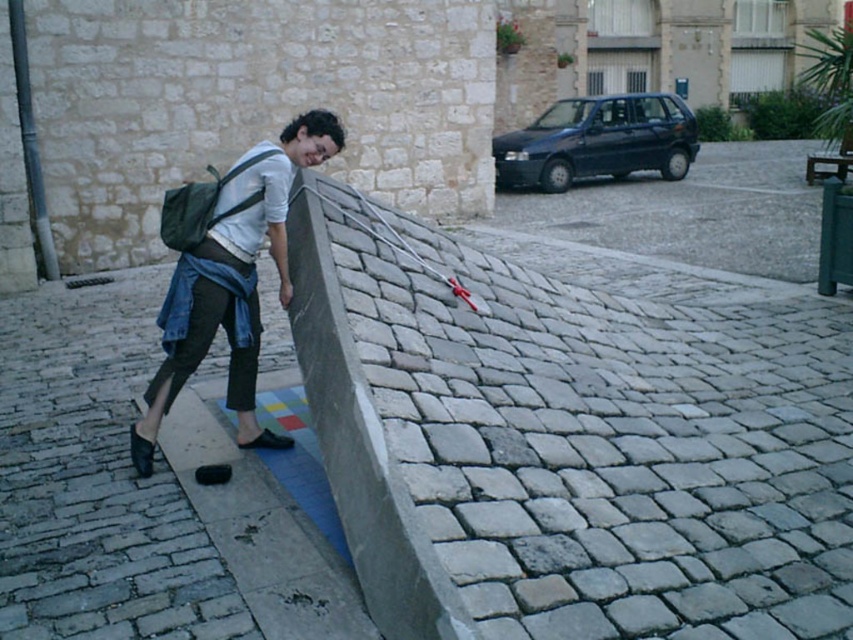
Consider the image. Is gray concrete ledge at center below denim jacket at left?

Correct, gray concrete ledge at center is located below denim jacket at left.

Is point (480, 516) positioned after point (248, 397)?

No.

Which is behind, point (791, 536) or point (277, 160)?

Positioned behind is point (277, 160).

The width and height of the screenshot is (853, 640). In order to click on gray concrete ledge at center in this screenshot , I will do `click(567, 444)`.